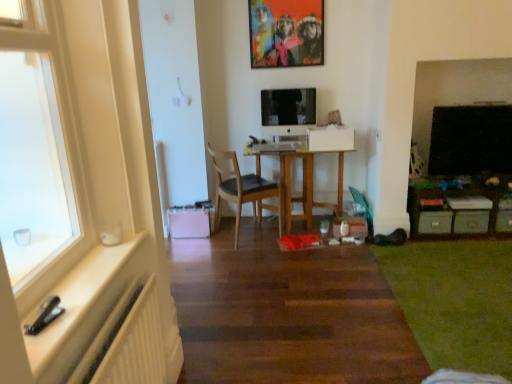
Identify the location of space that is in front of green matte drawer at lower right, the first drawer from the left. (440, 241).